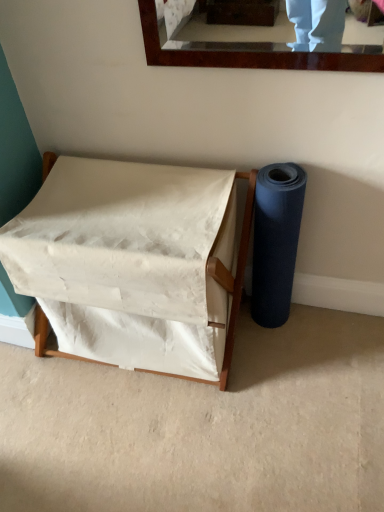
Question: Can you confirm if white fabric hamper at center is taller than blue rubber mat at right?

Choices:
 (A) yes
 (B) no

Answer: (B)

Question: From the image's perspective, is white fabric hamper at center under blue rubber mat at right?

Choices:
 (A) no
 (B) yes

Answer: (B)

Question: Does white fabric hamper at center lie in front of blue rubber mat at right?

Choices:
 (A) yes
 (B) no

Answer: (A)

Question: Does white fabric hamper at center turn towards blue rubber mat at right?

Choices:
 (A) yes
 (B) no

Answer: (B)

Question: From a real-world perspective, is white fabric hamper at center on top of blue rubber mat at right?

Choices:
 (A) no
 (B) yes

Answer: (A)

Question: Is white fabric hamper at center directly adjacent to blue rubber mat at right?

Choices:
 (A) yes
 (B) no

Answer: (B)

Question: From the image's perspective, is blue rubber mat at right under white fabric hamper at center?

Choices:
 (A) no
 (B) yes

Answer: (A)

Question: Is blue rubber mat at right positioned behind white fabric hamper at center?

Choices:
 (A) yes
 (B) no

Answer: (A)

Question: Is blue rubber mat at right facing towards white fabric hamper at center?

Choices:
 (A) no
 (B) yes

Answer: (A)

Question: From the image's perspective, is blue rubber mat at right above white fabric hamper at center?

Choices:
 (A) yes
 (B) no

Answer: (A)

Question: Does blue rubber mat at right touch white fabric hamper at center?

Choices:
 (A) no
 (B) yes

Answer: (A)

Question: Is white fabric hamper at center at the back of blue rubber mat at right?

Choices:
 (A) yes
 (B) no

Answer: (B)

Question: Looking at their shapes, would you say white fabric hamper at center is wider or thinner than blue rubber mat at right?

Choices:
 (A) wide
 (B) thin

Answer: (A)